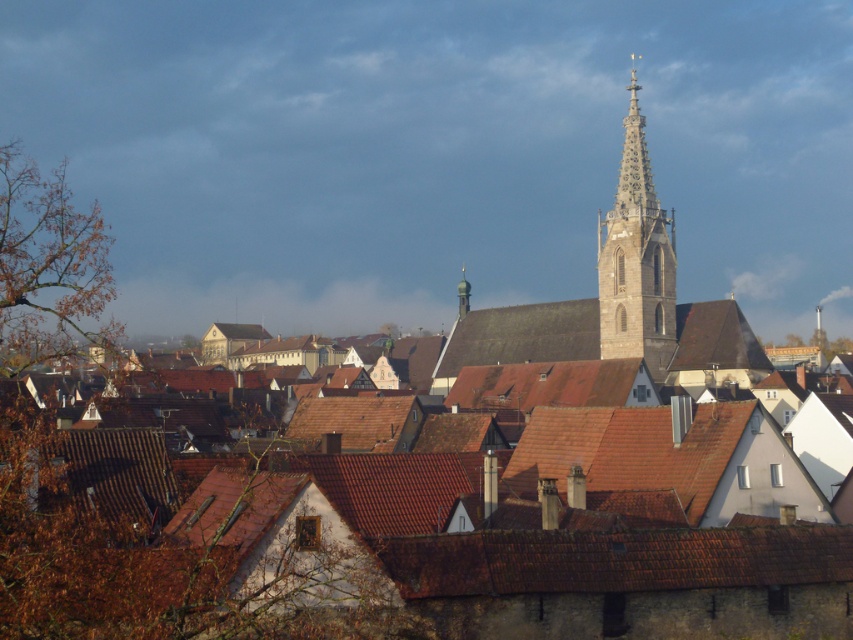
You are an architect analyzing the historic town layout. You observe the stone steeple at center and the green metallic spire at upper center. Which of these two structures has a greater width?

The stone steeple at center has a greater width than the green metallic spire at upper center, according to the provided description.

You are standing in the historic town and want to take a photo of the brown tile roof at lower center and the stone steeple at center. Which object should you focus on first if you want to capture both in one frame without moving the camera?

The brown tile roof at lower center is not as tall as the stone steeple at center, so you should focus on the stone steeple at center first to ensure it fits within the frame along with the brown tile roof at lower center.